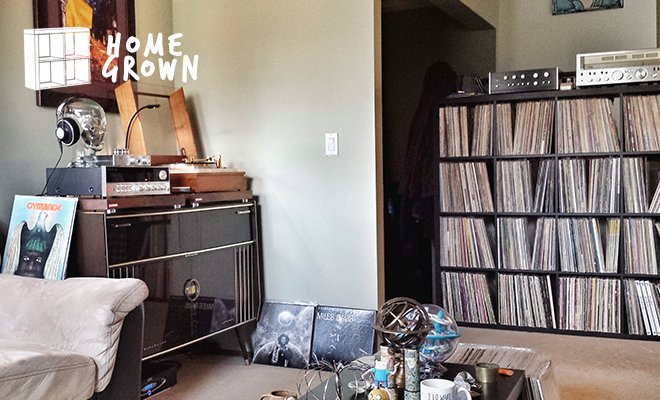
At what (x,y) coordinates should I click in order to perform the action: click on knob. Please return your answer as a coordinate pair (x, y). Looking at the image, I should click on (160, 174), (616, 73), (641, 73).